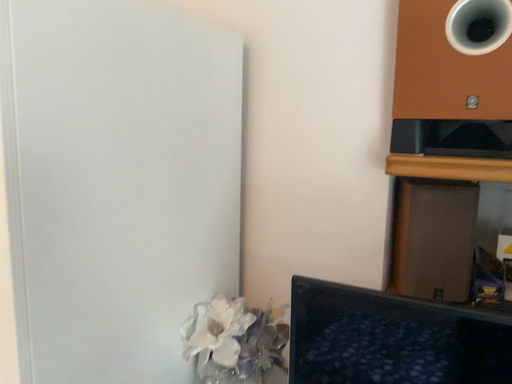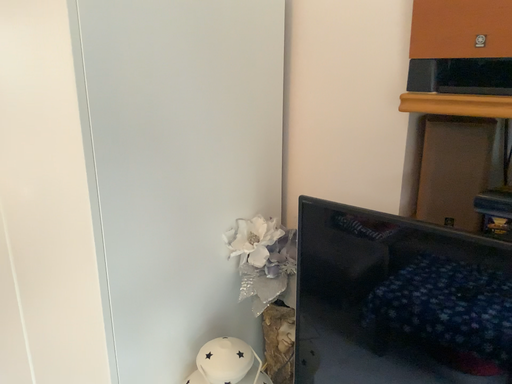
Question: Which way did the camera rotate in the video?

Choices:
 (A) rotated upward
 (B) rotated downward

Answer: (B)